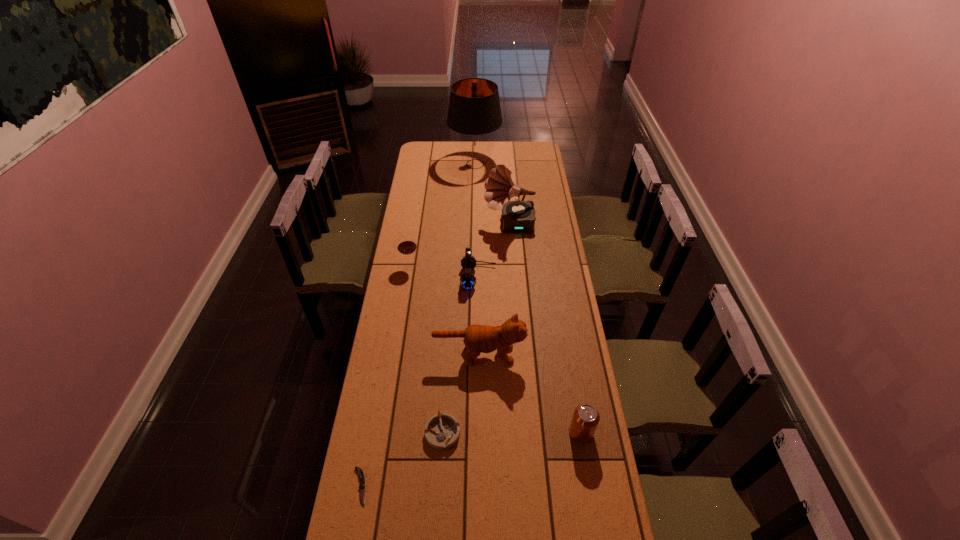
This screenshot has width=960, height=540. What are the coordinates of `lampshade` in the screenshot? It's located at (474, 114).

Image resolution: width=960 pixels, height=540 pixels. Find the location of `the farthest object`. the farthest object is located at coordinates (474, 114).

Locate an element on the screen. record player is located at coordinates point(518,217).

I want to click on the second farthest object, so click(x=518, y=217).

At what (x,y) coordinates should I click in order to perform the action: click on the fourth nearest object. Please return your answer as a coordinate pair (x, y). Looking at the image, I should click on (477, 338).

Where is `the sixth shortest object`? The width and height of the screenshot is (960, 540). the sixth shortest object is located at coordinates (477, 338).

This screenshot has height=540, width=960. I want to click on headset, so click(468, 281).

Image resolution: width=960 pixels, height=540 pixels. I want to click on wineglass, so click(x=406, y=245).

Image resolution: width=960 pixels, height=540 pixels. Find the location of `the rightmost object`. the rightmost object is located at coordinates (585, 419).

Where is `the second shortest object`? the second shortest object is located at coordinates [x=442, y=431].